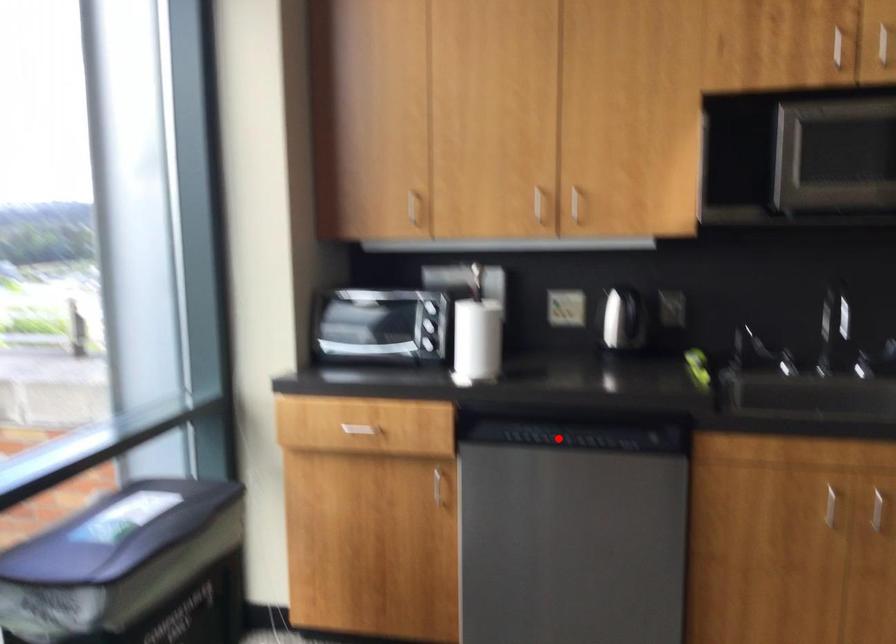
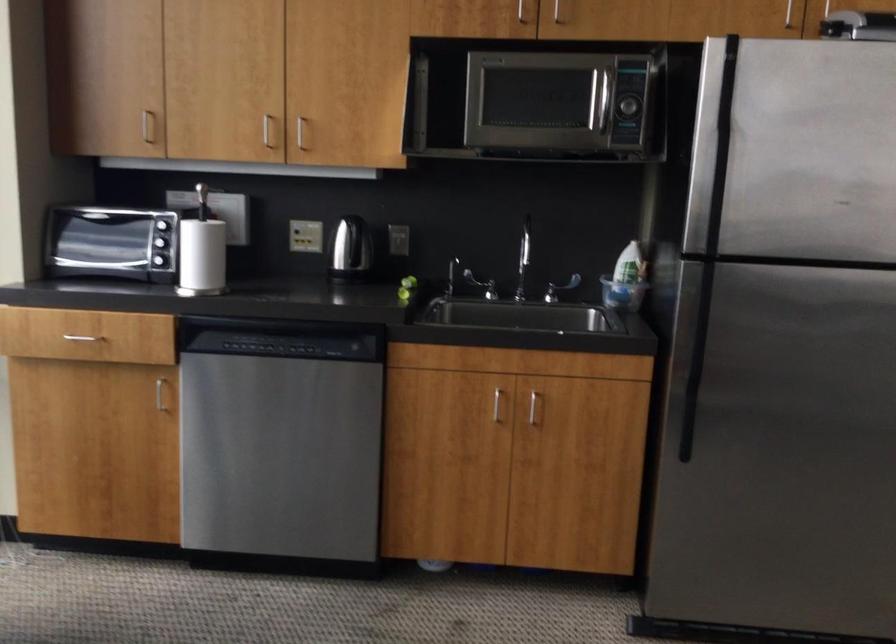
In the second image, find the point that corresponds to the highlighted location in the first image.

(277, 346)